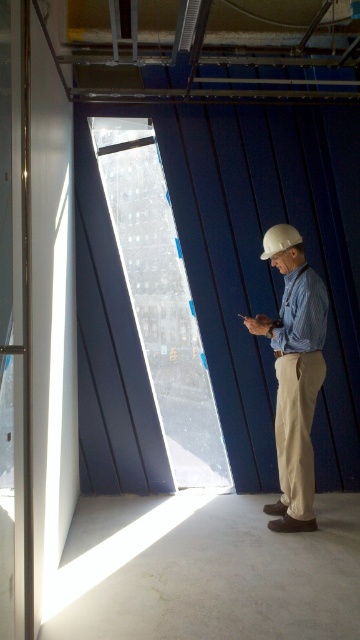
Can you confirm if striped cotton shirt at center is positioned below white matte helmet at center?

Correct, striped cotton shirt at center is located below white matte helmet at center.

Is striped cotton shirt at center shorter than white matte helmet at center?

Incorrect, striped cotton shirt at center's height does not fall short of white matte helmet at center's.

Is point (290, 404) positioned after point (282, 246)?

No, (290, 404) is closer to viewer.

Where is `striped cotton shirt at center`? striped cotton shirt at center is located at coordinates (294, 374).